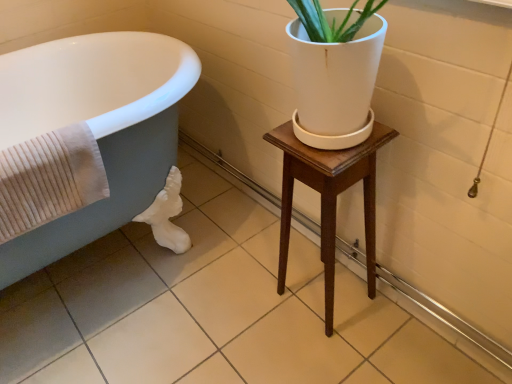
Question: Does matte gray bathtub at left have a lesser width compared to beige ribbed towel at left?

Choices:
 (A) no
 (B) yes

Answer: (A)

Question: Is beige ribbed towel at left located within matte gray bathtub at left?

Choices:
 (A) no
 (B) yes

Answer: (B)

Question: Is matte gray bathtub at left taller than beige ribbed towel at left?

Choices:
 (A) no
 (B) yes

Answer: (B)

Question: From a real-world perspective, is matte gray bathtub at left over beige ribbed towel at left?

Choices:
 (A) yes
 (B) no

Answer: (B)

Question: Are matte gray bathtub at left and beige ribbed towel at left beside each other?

Choices:
 (A) yes
 (B) no

Answer: (B)

Question: Considering the relative sizes of matte gray bathtub at left and beige ribbed towel at left in the image provided, is matte gray bathtub at left wider than beige ribbed towel at left?

Choices:
 (A) no
 (B) yes

Answer: (B)

Question: Considering the relative positions of wooden stool at center and matte gray bathtub at left in the image provided, is wooden stool at center to the right of matte gray bathtub at left from the viewer's perspective?

Choices:
 (A) no
 (B) yes

Answer: (B)

Question: Can you confirm if wooden stool at center is bigger than matte gray bathtub at left?

Choices:
 (A) no
 (B) yes

Answer: (A)

Question: From the image's perspective, is wooden stool at center located above matte gray bathtub at left?

Choices:
 (A) yes
 (B) no

Answer: (B)

Question: Is wooden stool at center not near matte gray bathtub at left?

Choices:
 (A) yes
 (B) no

Answer: (B)

Question: Is matte gray bathtub at left inside wooden stool at center?

Choices:
 (A) no
 (B) yes

Answer: (A)

Question: From the image's perspective, is wooden stool at center located beneath matte gray bathtub at left?

Choices:
 (A) no
 (B) yes

Answer: (B)

Question: Could you tell me if beige ribbed towel at left is facing matte gray bathtub at left?

Choices:
 (A) no
 (B) yes

Answer: (B)